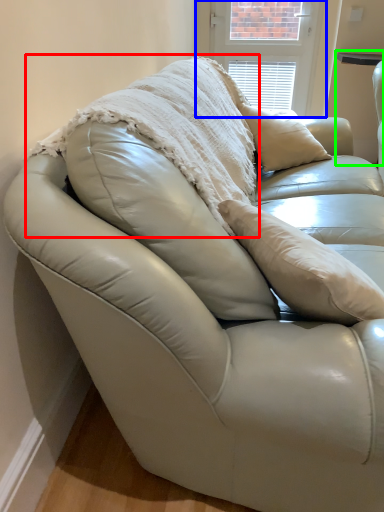
Question: Which object is positioned closest to blanket (highlighted by a red box)? Select from window screen (highlighted by a blue box) and table (highlighted by a green box).

Choices:
 (A) window screen
 (B) table

Answer: (A)